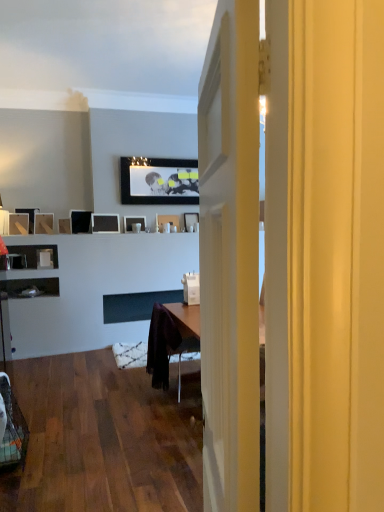
Question: Would you say matte wood picture frame at left, which is counted as the eighth picture frame, starting from the right, is inside or outside plastic mesh swivel chair at lower left?

Choices:
 (A) outside
 (B) inside

Answer: (A)

Question: Does point (41, 224) appear closer or farther from the camera than point (14, 423)?

Choices:
 (A) farther
 (B) closer

Answer: (A)

Question: Which object is positioned farthest from the matte black picture frame at center, the 1th picture frame from the right?

Choices:
 (A) matte wooden picture frame at left, placed as the second picture frame when sorted from left to right
 (B) matte black picture frame at upper center, which appears as the third picture frame when viewed from the right
 (C) plastic mesh swivel chair at lower left
 (D) matte black picture frame at left, which is the tenth picture frame in right-to-left order
 (E) purple fabric chair at center

Answer: (C)

Question: Which of these objects is positioned farthest from the purple fabric chair at center?

Choices:
 (A) matte wooden picture frame at left, arranged as the ninth picture frame when viewed from the right
 (B) matte black picture frame at center, the fifth picture frame when ordered from right to left
 (C) matte black picture frame at center, marked as the 10th picture frame in a left-to-right arrangement
 (D) matte black picture frame at left, which is the tenth picture frame in right-to-left order
 (E) matte black picture frame at upper center, which appears as the third picture frame when viewed from the right

Answer: (E)